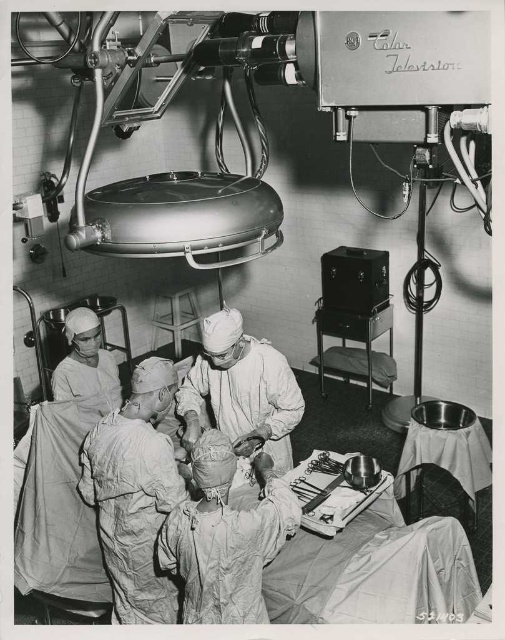
Looking at this image, is white matte/soft doctor at center thinner than white matte doctor at left?

No, white matte/soft doctor at center is not thinner than white matte doctor at left.

The width and height of the screenshot is (505, 640). What do you see at coordinates (241, 392) in the screenshot?
I see `white matte/soft doctor at center` at bounding box center [241, 392].

The width and height of the screenshot is (505, 640). Identify the location of white matte/soft doctor at center. (241, 392).

Does white matte surgical gown at center appear over white matte doctor at left?

No, white matte surgical gown at center is not above white matte doctor at left.

At what (x,y) coordinates should I click in order to perform the action: click on white matte surgical gown at center. Please return your answer as a coordinate pair (x, y). Looking at the image, I should click on (134, 493).

Is white matte surgical gown at center to the left of metallic silver tray at center from the viewer's perspective?

Indeed, white matte surgical gown at center is positioned on the left side of metallic silver tray at center.

The height and width of the screenshot is (640, 505). In order to click on white matte surgical gown at center in this screenshot , I will do `click(134, 493)`.

Image resolution: width=505 pixels, height=640 pixels. What do you see at coordinates (134, 493) in the screenshot? I see `white matte surgical gown at center` at bounding box center [134, 493].

At what (x,y) coordinates should I click in order to perform the action: click on white matte surgical gown at center. Please return your answer as a coordinate pair (x, y). Image resolution: width=505 pixels, height=640 pixels. Looking at the image, I should click on (134, 493).